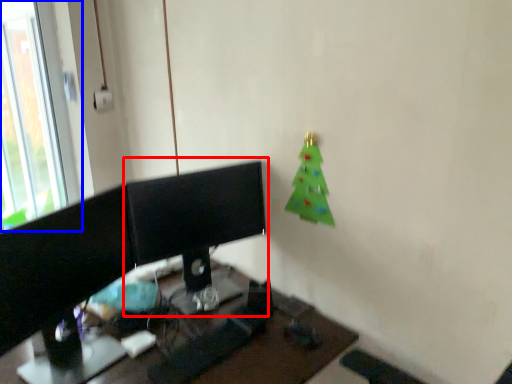
Question: Which point is closer to the camera, desktop computer (highlighted by a red box) or window (highlighted by a blue box)?

Choices:
 (A) desktop computer
 (B) window

Answer: (A)